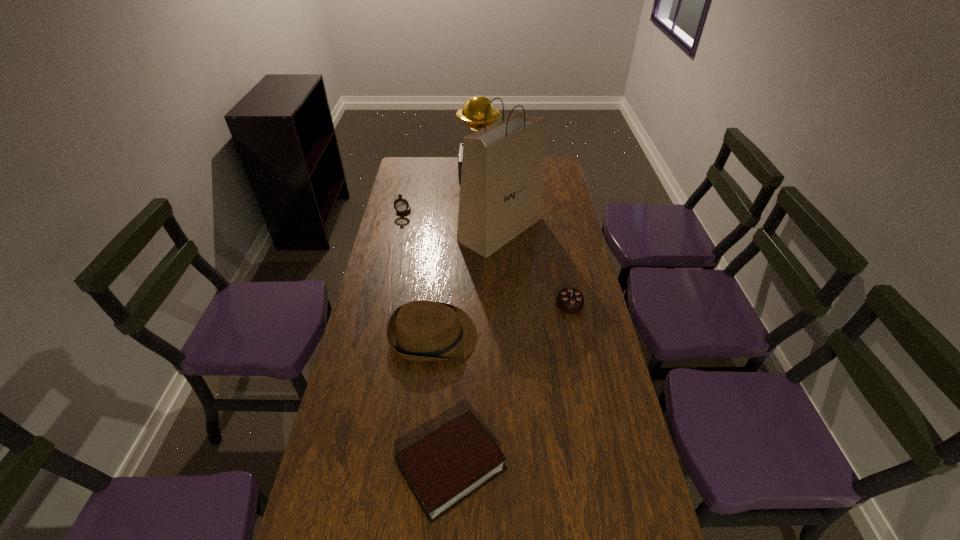
The width and height of the screenshot is (960, 540). Find the location of `free space that satisfies the following two spatial constraints: 1. on the front-facing side of the farthest object; 2. on the face of the leftmost object`. free space that satisfies the following two spatial constraints: 1. on the front-facing side of the farthest object; 2. on the face of the leftmost object is located at coordinates (479, 209).

Image resolution: width=960 pixels, height=540 pixels. I want to click on blank area in the image that satisfies the following two spatial constraints: 1. on the front-facing side of the second tallest object; 2. on the back side of the chocolate cake, so click(x=478, y=305).

Locate an element on the screen. This screenshot has height=540, width=960. blank area in the image that satisfies the following two spatial constraints: 1. on the front-facing side of the farthest object; 2. on the face of the leftmost object is located at coordinates (479, 209).

The image size is (960, 540). What are the coordinates of `free space that satisfies the following two spatial constraints: 1. on the face of the leftmost object; 2. on the right side of the nearest object` in the screenshot? It's located at (347, 467).